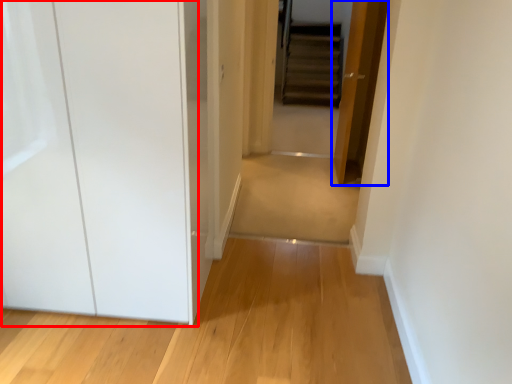
Question: Which point is closer to the camera, glass door (highlighted by a red box) or door (highlighted by a blue box)?

Choices:
 (A) glass door
 (B) door

Answer: (A)